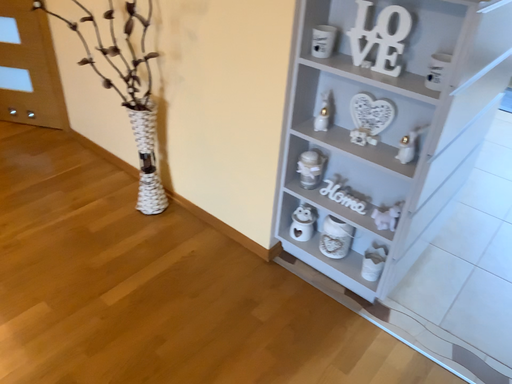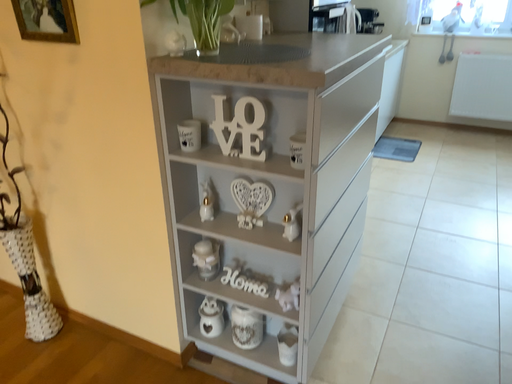
Question: How did the camera likely rotate when shooting the video?

Choices:
 (A) rotated upward
 (B) rotated downward

Answer: (A)